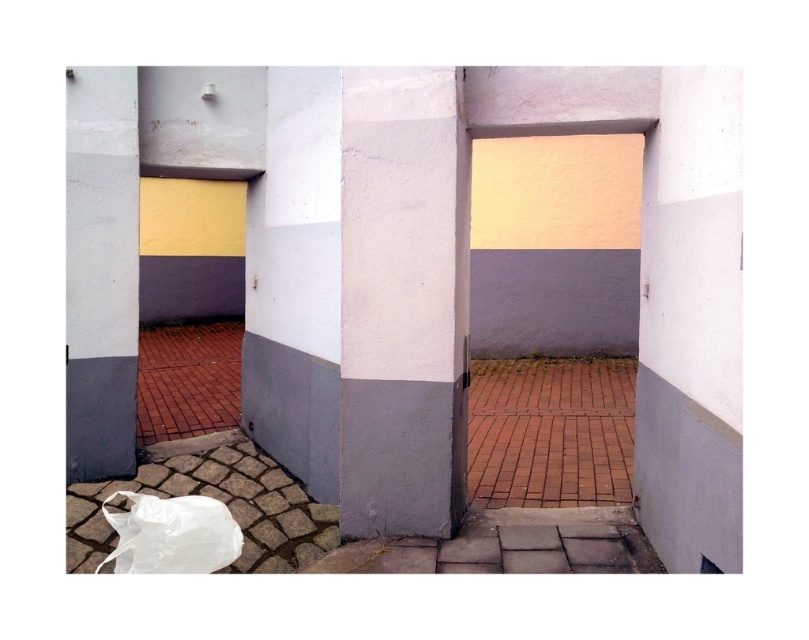
You are standing in front of two open doorways framed by colored walls. There is a white matte pillar at center between them. If you want to walk directly to the pillar, which direction should you move from your current position?

Move straight ahead towards the white matte pillar at center located at point coordinates (403, 300) between the two doorways.

You are standing in front of the two doorways and see the white matte pillar at center. Which direction would you need to move to reach the pillar from your current position?

Since the white matte pillar at center is located at point [403,300], you would need to move directly towards the center of the image to reach it from your current position in front of the doorways.

You are designing a pathway between the white matte pillar at center and the matte gray concrete pillar at left. If you want to ensure the path is wide enough for a standard wheelchair, which has a width of 80 cm, can you confirm if the space between them allows this?

The white matte pillar at center is wider than the matte gray concrete pillar at left. However, the description only provides information about their widths, not the distance between them. Without knowing the actual spacing between the pillars, it is impossible to determine if the path will accommodate an 80 cm wheelchair.